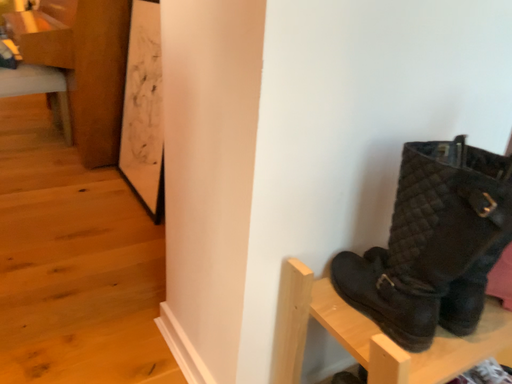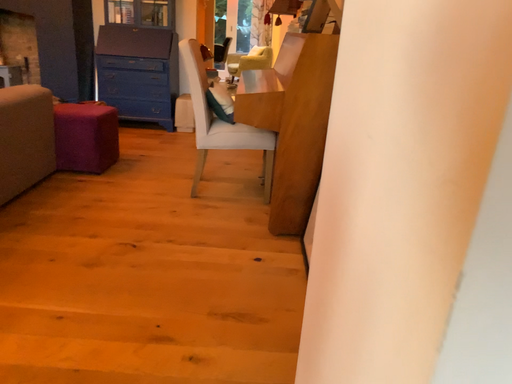
Question: How did the camera likely rotate when shooting the video?

Choices:
 (A) rotated left
 (B) rotated right

Answer: (A)